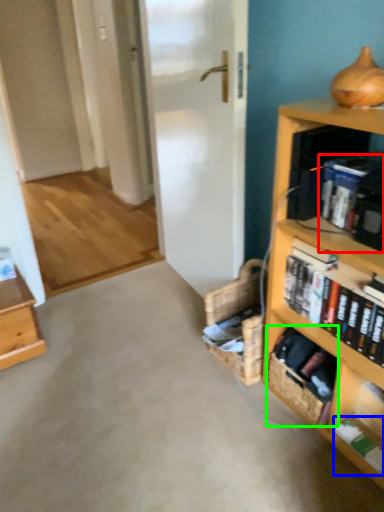
Question: Based on their relative distances, which object is farther from book (highlighted by a red box)? Choose from book (highlighted by a blue box) and basket (highlighted by a green box).

Choices:
 (A) book
 (B) basket

Answer: (A)